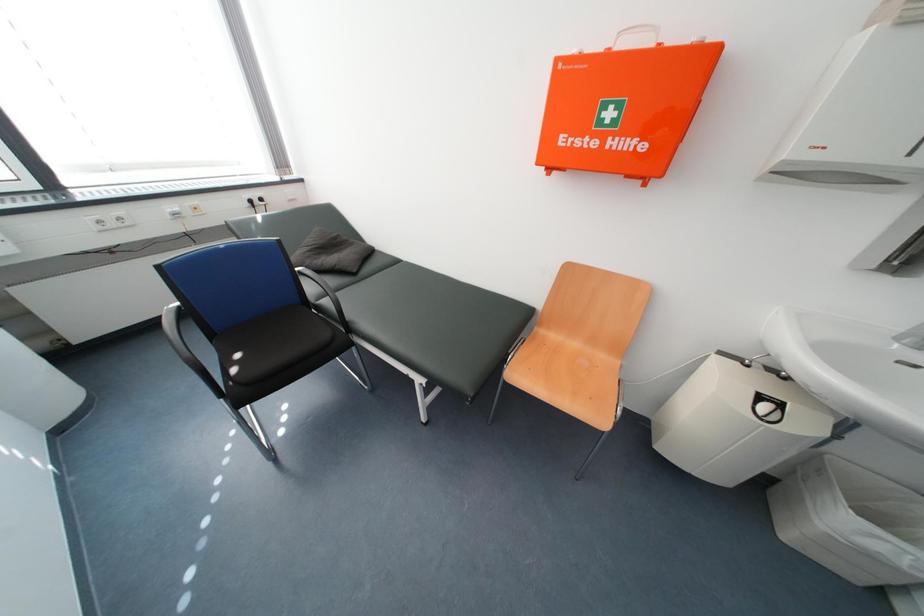
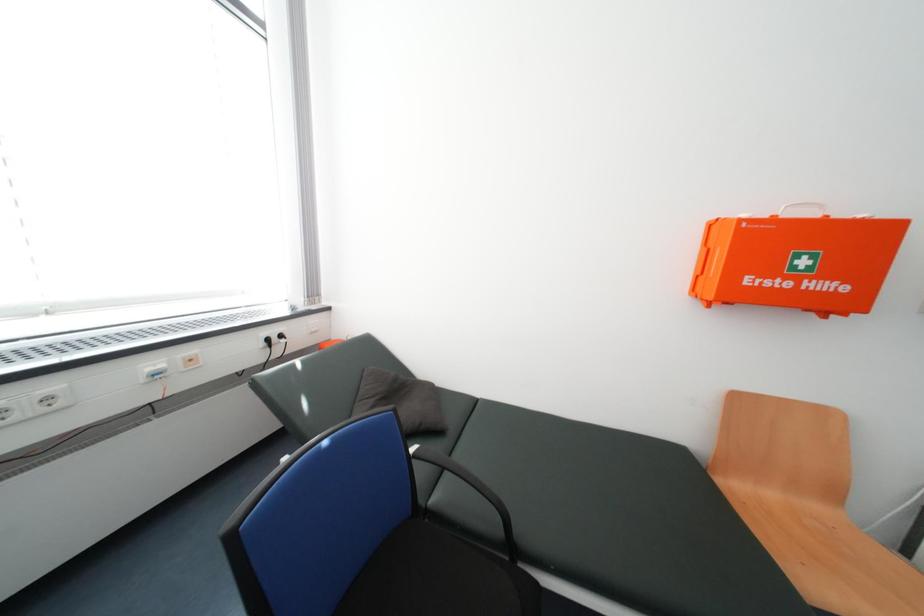
In a continuous first-person perspective shot, in which direction is the camera moving?

The movement direction of the cameraman is left, forward.